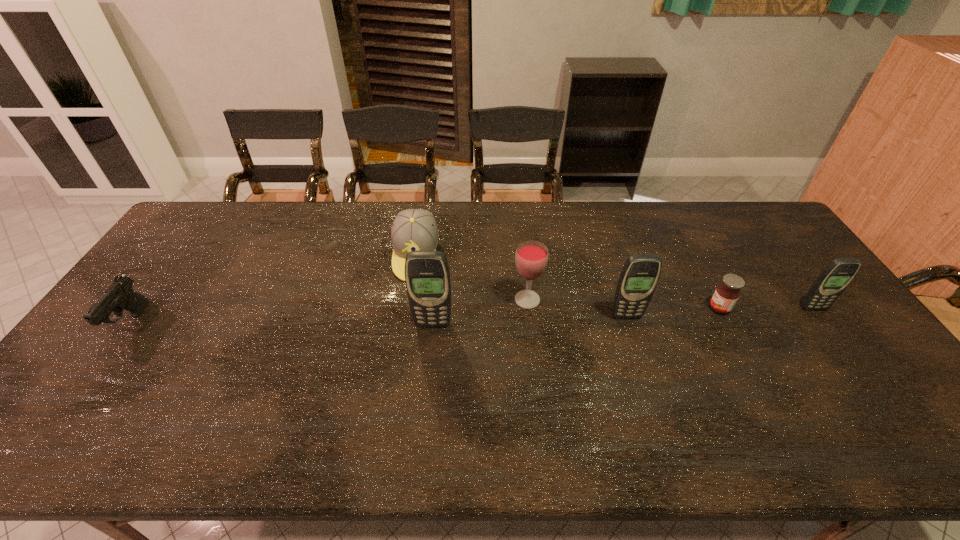
I want to click on unoccupied area between the wineglass and the rightmost cellular telephone, so click(x=670, y=304).

Find the location of a particular element. This screenshot has width=960, height=540. vacant region between the second nearest cellular telephone and the baseball cap is located at coordinates (521, 286).

The height and width of the screenshot is (540, 960). I want to click on vacant space in between the second cellular telephone from right to left and the second object from right to left, so click(673, 312).

Identify the location of free spot between the sixth object from left to right and the baseball cap. The height and width of the screenshot is (540, 960). (567, 282).

You are a GUI agent. You are given a task and a screenshot of the screen. Output one action in this format:
    pyautogui.click(x=<x>, y=<y>)
    Task: Click on the fourth closest object to the rightmost cellular telephone
    This screenshot has height=540, width=960.
    Given the screenshot: What is the action you would take?
    pyautogui.click(x=427, y=276)

This screenshot has width=960, height=540. I want to click on the third closest object to the leftmost cellular telephone, so click(640, 274).

Locate which cellular telephone is the closest to the nearest cellular telephone. Please provide its 2D coordinates. Your answer should be formatted as a tuple, i.e. [(x, y)], where the tuple contains the x and y coordinates of a point satisfying the conditions above.

[(640, 274)]

Locate which cellular telephone ranks in proximity to the farthest object. Please provide its 2D coordinates. Your answer should be formatted as a tuple, i.e. [(x, y)], where the tuple contains the x and y coordinates of a point satisfying the conditions above.

[(427, 276)]

Where is `free space in the image that satisfies the following two spatial constraints: 1. on the label side of the second object from right to left; 2. on the screen of the sixth shortest object`? The width and height of the screenshot is (960, 540). free space in the image that satisfies the following two spatial constraints: 1. on the label side of the second object from right to left; 2. on the screen of the sixth shortest object is located at coordinates (724, 316).